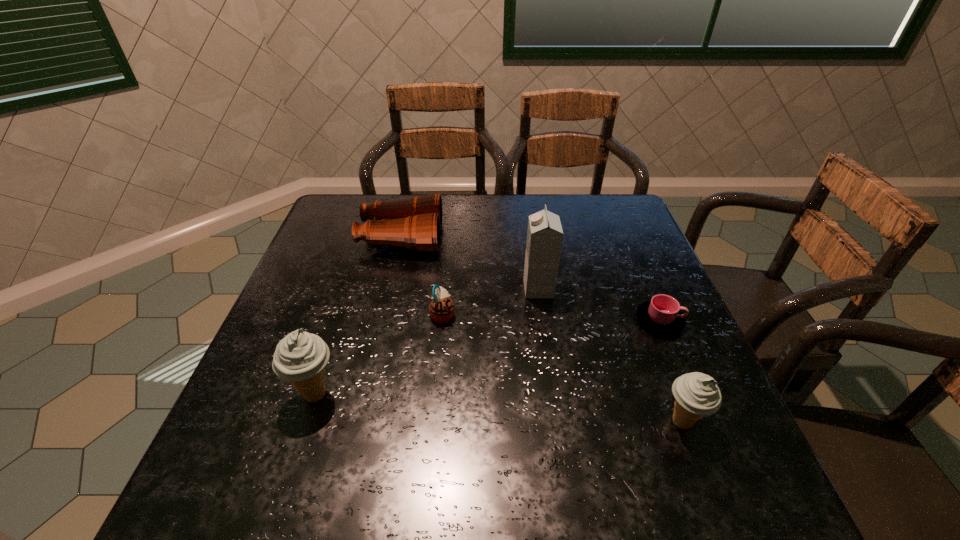
Where is `icecream that is at the right edge`? The height and width of the screenshot is (540, 960). icecream that is at the right edge is located at coordinates pos(696,394).

Image resolution: width=960 pixels, height=540 pixels. Find the location of `cup that is positioned at the right edge`. cup that is positioned at the right edge is located at coordinates (662, 315).

Locate an element on the screen. This screenshot has width=960, height=540. object that is positioned at the far left corner is located at coordinates (415, 223).

Where is `object positioned at the near left corner`? object positioned at the near left corner is located at coordinates (300, 358).

Identify the location of object located in the near right corner section of the desktop. pyautogui.click(x=696, y=394).

This screenshot has width=960, height=540. I want to click on blank space at the far edge of the desktop, so click(x=504, y=216).

At what (x,y) coordinates should I click in order to perform the action: click on vacant area at the near edge of the desktop. Please return your answer as a coordinate pair (x, y). Looking at the image, I should click on (539, 405).

At what (x,y) coordinates should I click in order to perform the action: click on vacant space at the left edge of the desktop. Please return your answer as a coordinate pair (x, y). The width and height of the screenshot is (960, 540). Looking at the image, I should click on (329, 250).

The image size is (960, 540). I want to click on blank space at the right edge of the desktop, so click(637, 256).

Locate an element on the screen. vacant region at the far left corner is located at coordinates (349, 203).